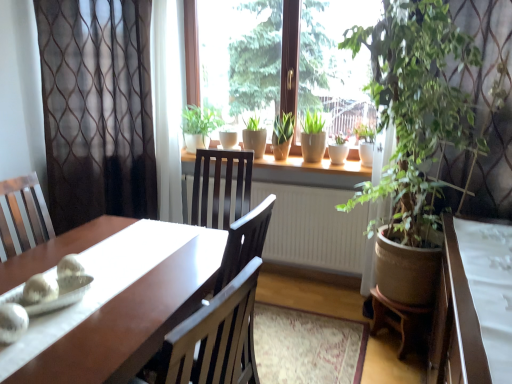
Question: From the image's perspective, is green matte pot at center, the second houseplant from the right, below green matte plant at window, which is the fourth houseplant in right-to-left order?

Choices:
 (A) yes
 (B) no

Answer: (A)

Question: Is green matte pot at center, placed as the 4th houseplant when sorted from left to right, shorter than green matte plant at window, which ranks as the second houseplant in left-to-right order?

Choices:
 (A) no
 (B) yes

Answer: (B)

Question: Is green matte plant at window, which is the fourth houseplant in right-to-left order, located within green matte pot at center, the second houseplant from the right?

Choices:
 (A) no
 (B) yes

Answer: (A)

Question: From the image's perspective, is green matte pot at center, the second houseplant from the right, over green matte plant at window, which is the fourth houseplant in right-to-left order?

Choices:
 (A) no
 (B) yes

Answer: (A)

Question: Can you confirm if green matte pot at center, the second houseplant from the right, is positioned to the right of green matte plant at window, which ranks as the second houseplant in left-to-right order?

Choices:
 (A) yes
 (B) no

Answer: (A)

Question: In terms of size, does green matte plant at center, the fifth houseplant in the right-to-left sequence, appear bigger or smaller than sheer brown curtain at upper left, positioned as the second curtain in left-to-right order?

Choices:
 (A) big
 (B) small

Answer: (B)

Question: From a real-world perspective, is green matte plant at center, the first houseplant in the left-to-right sequence, physically located above or below sheer brown curtain at upper left, which appears as the first curtain when viewed from the right?

Choices:
 (A) below
 (B) above

Answer: (A)

Question: From the image's perspective, relative to sheer brown curtain at upper left, positioned as the second curtain in left-to-right order, is green matte plant at center, the fifth houseplant in the right-to-left sequence, above or below?

Choices:
 (A) below
 (B) above

Answer: (A)

Question: In the image, is green matte plant at center, the first houseplant in the left-to-right sequence, on the left side or the right side of sheer brown curtain at upper left, which appears as the first curtain when viewed from the right?

Choices:
 (A) left
 (B) right

Answer: (B)

Question: Is white glossy table at lower right wider or thinner than green matte plant at window, the third houseplant when ordered from right to left?

Choices:
 (A) thin
 (B) wide

Answer: (B)

Question: From their relative heights in the image, would you say white glossy table at lower right is taller or shorter than green matte plant at window, positioned as the third houseplant in left-to-right order?

Choices:
 (A) tall
 (B) short

Answer: (A)

Question: Is white glossy table at lower right bigger or smaller than green matte plant at window, the third houseplant when ordered from right to left?

Choices:
 (A) small
 (B) big

Answer: (B)

Question: Would you say white glossy table at lower right is inside or outside green matte plant at window, the third houseplant when ordered from right to left?

Choices:
 (A) inside
 (B) outside

Answer: (B)

Question: Is green leafy plant at right, which is the 1th houseplant from right to left, spatially inside green matte plant at center, the first houseplant in the left-to-right sequence, or outside of it?

Choices:
 (A) outside
 (B) inside

Answer: (A)

Question: Does point (399, 48) appear closer or farther from the camera than point (205, 132)?

Choices:
 (A) farther
 (B) closer

Answer: (B)